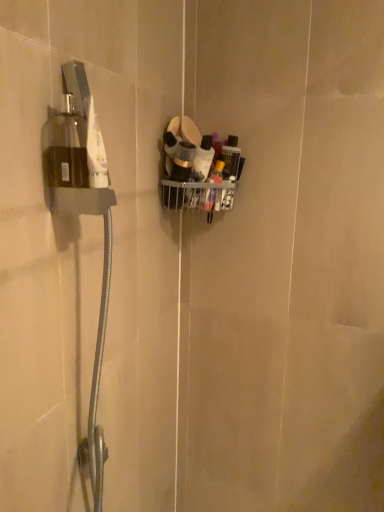
Question: Is matte black container at center, marked as the 2th toiletry in a right-to-left arrangement, positioned behind translucent plastic bottles at upper right, which appears as the 2th toiletry when viewed from the left?

Choices:
 (A) no
 (B) yes

Answer: (A)

Question: From a real-world perspective, is matte black container at center, the first toiletry when ordered from left to right, positioned under translucent plastic bottles at upper right, which appears as the 2th toiletry when viewed from the left, based on gravity?

Choices:
 (A) yes
 (B) no

Answer: (B)

Question: From the image's perspective, is matte black container at center, marked as the 2th toiletry in a right-to-left arrangement, located above translucent plastic bottles at upper right, which ranks as the 1th toiletry in right-to-left order?

Choices:
 (A) no
 (B) yes

Answer: (B)

Question: Could you tell me if matte black container at center, marked as the 2th toiletry in a right-to-left arrangement, is facing translucent plastic bottles at upper right, which appears as the 2th toiletry when viewed from the left?

Choices:
 (A) no
 (B) yes

Answer: (A)

Question: Can you confirm if matte black container at center, the first toiletry when ordered from left to right, is smaller than translucent plastic bottles at upper right, which appears as the 2th toiletry when viewed from the left?

Choices:
 (A) yes
 (B) no

Answer: (B)

Question: Considering the relative sizes of matte black container at center, marked as the 2th toiletry in a right-to-left arrangement, and translucent plastic bottles at upper right, which appears as the 2th toiletry when viewed from the left, in the image provided, is matte black container at center, marked as the 2th toiletry in a right-to-left arrangement, taller than translucent plastic bottles at upper right, which appears as the 2th toiletry when viewed from the left,?

Choices:
 (A) yes
 (B) no

Answer: (A)

Question: From the image's perspective, is translucent plastic bottles at upper right, which appears as the 2th toiletry when viewed from the left, located beneath matte black container at center, the first toiletry when ordered from left to right?

Choices:
 (A) yes
 (B) no

Answer: (A)

Question: Is matte black container at center, the first toiletry when ordered from left to right, completely or partially inside translucent plastic bottles at upper right, which appears as the 2th toiletry when viewed from the left?

Choices:
 (A) no
 (B) yes

Answer: (A)

Question: Is the position of translucent plastic bottles at upper right, which ranks as the 1th toiletry in right-to-left order, less distant than that of matte black container at center, marked as the 2th toiletry in a right-to-left arrangement?

Choices:
 (A) yes
 (B) no

Answer: (B)

Question: Considering the relative sizes of translucent plastic bottles at upper right, which appears as the 2th toiletry when viewed from the left, and matte black container at center, marked as the 2th toiletry in a right-to-left arrangement, in the image provided, is translucent plastic bottles at upper right, which appears as the 2th toiletry when viewed from the left, smaller than matte black container at center, marked as the 2th toiletry in a right-to-left arrangement,?

Choices:
 (A) no
 (B) yes

Answer: (B)

Question: Can you confirm if translucent plastic bottles at upper right, which ranks as the 1th toiletry in right-to-left order, is bigger than matte black container at center, marked as the 2th toiletry in a right-to-left arrangement?

Choices:
 (A) yes
 (B) no

Answer: (B)

Question: Can you see translucent plastic bottles at upper right, which appears as the 2th toiletry when viewed from the left, touching matte black container at center, the first toiletry when ordered from left to right?

Choices:
 (A) no
 (B) yes

Answer: (B)

Question: From a real-world perspective, is translucent plastic bottles at upper right, which ranks as the 1th toiletry in right-to-left order, physically located above or below matte black container at center, marked as the 2th toiletry in a right-to-left arrangement?

Choices:
 (A) above
 (B) below

Answer: (B)